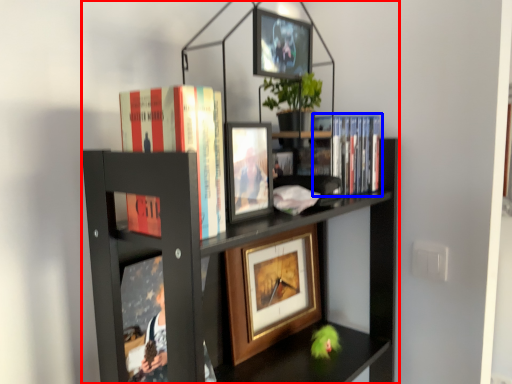
Question: Which of the following is the closest to the observer, bookcase (highlighted by a red box) or book (highlighted by a blue box)?

Choices:
 (A) bookcase
 (B) book

Answer: (A)